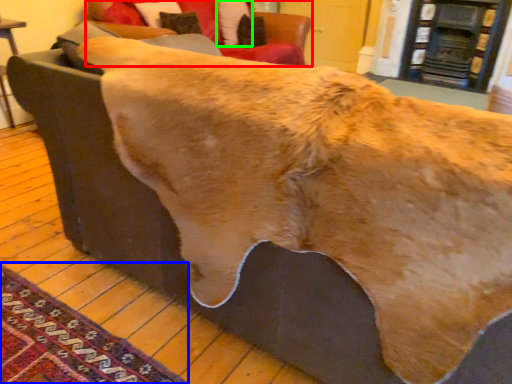
Question: Considering the real-world distances, which object is closest to studio couch (highlighted by a red box)? mat (highlighted by a blue box) or pillow (highlighted by a green box).

Choices:
 (A) mat
 (B) pillow

Answer: (B)